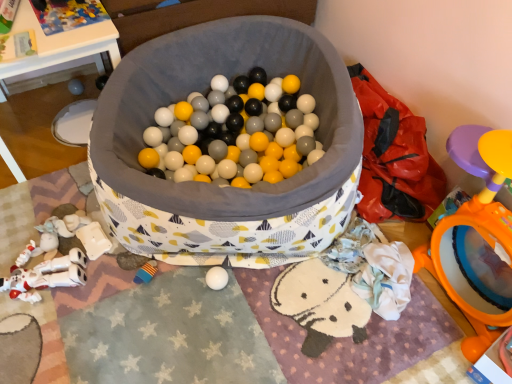
This screenshot has width=512, height=384. Identify the location of free location to the right of white plush toy at lower left, which is the 4th toy in top-to-bottom order. (108, 288).